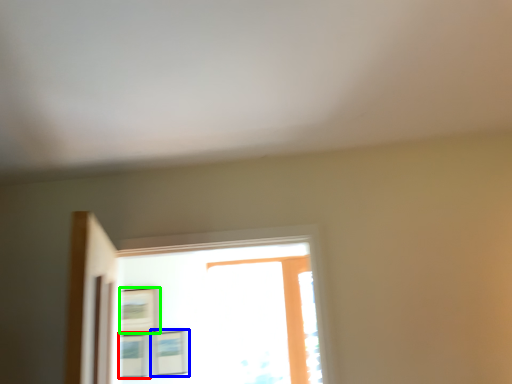
Question: Considering the real-world distances, which object is farthest from picture frame (highlighted by a red box)? picture frame (highlighted by a blue box) or picture frame (highlighted by a green box)?

Choices:
 (A) picture frame
 (B) picture frame

Answer: (B)